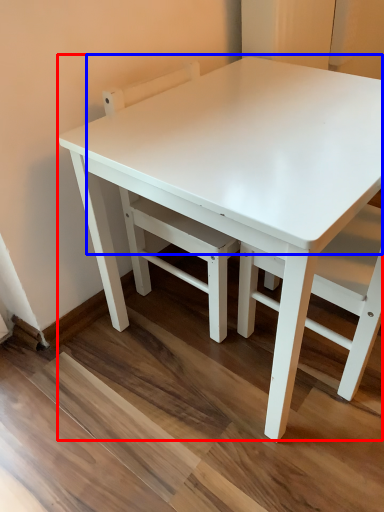
Question: Which object appears farthest to the camera in this image, table (highlighted by a red box) or table top (highlighted by a blue box)?

Choices:
 (A) table
 (B) table top

Answer: (B)